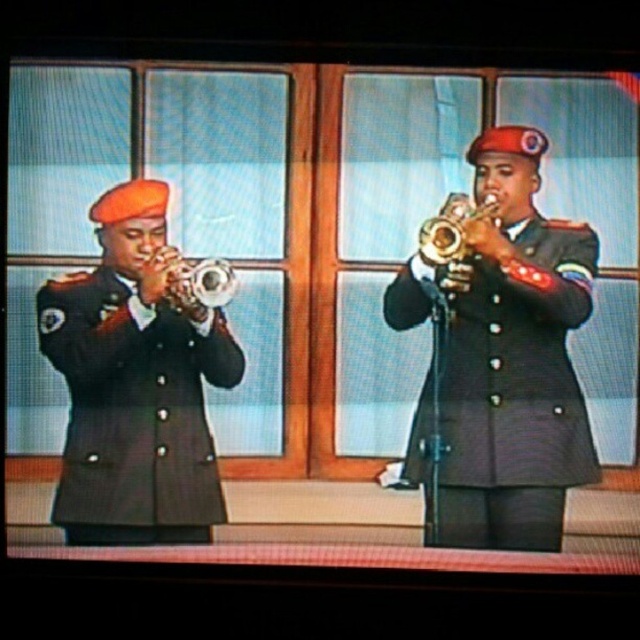
Can you confirm if black matte uniform at center is positioned above gold shiny trumpet at center?

No, black matte uniform at center is not above gold shiny trumpet at center.

In the scene shown: Which is below, black matte uniform at center or gold shiny trumpet at center?

black matte uniform at center is below.

This screenshot has height=640, width=640. I want to click on black matte uniform at center, so click(x=515, y=392).

Is gold shiny trumpet at center thinner than brushed metal trumpet at left?

Indeed, gold shiny trumpet at center has a lesser width compared to brushed metal trumpet at left.

Can you confirm if gold shiny trumpet at center is positioned above brushed metal trumpet at left?

Yes.

Does point (467, 252) come farther from viewer compared to point (179, 262)?

That is True.

Where is `gold shiny trumpet at center`? This screenshot has height=640, width=640. gold shiny trumpet at center is located at coordinates (451, 240).

Is point (208, 440) in front of point (548, 486)?

No, (208, 440) is behind (548, 486).

Is matte black trumpet at left shorter than black matte uniform at center?

No.

What do you see at coordinates (134, 384) in the screenshot? I see `matte black trumpet at left` at bounding box center [134, 384].

I want to click on matte black trumpet at left, so click(134, 384).